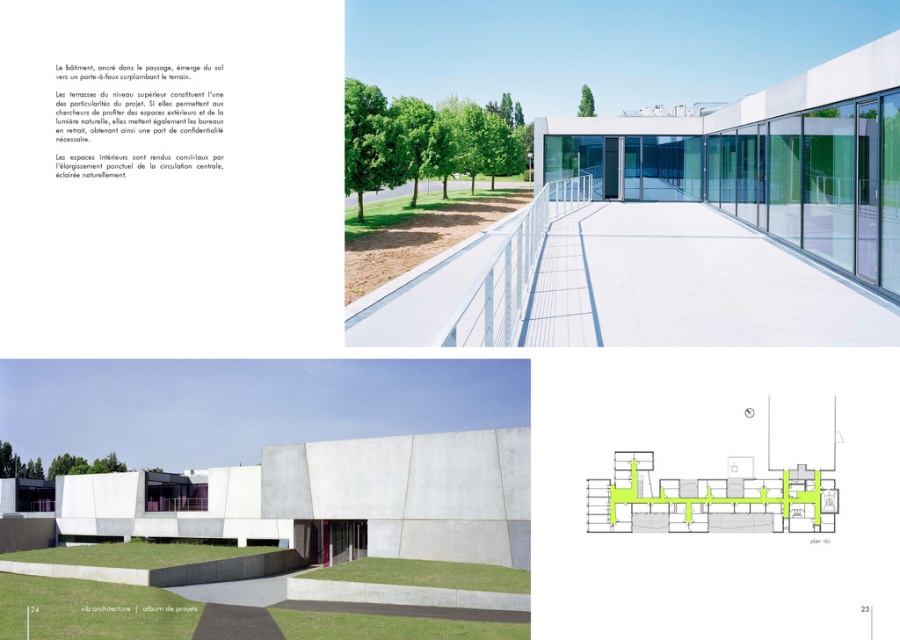
Can you confirm if white concrete building at center is positioned to the right of green concrete staircase at center?

Incorrect, white concrete building at center is not on the right side of green concrete staircase at center.

The image size is (900, 640). Describe the element at coordinates (338, 497) in the screenshot. I see `white concrete building at center` at that location.

Identify the location of white concrete building at center. The image size is (900, 640). (338, 497).

Based on the photo, who is higher up, white glass building at center or green concrete staircase at center?

white glass building at center is higher up.

Who is more distant from viewer, (361, 326) or (788, 525)?

Positioned behind is point (361, 326).

Identify the location of white glass building at center. This screenshot has width=900, height=640. (729, 218).

Can you confirm if white glass building at center is smaller than white concrete building at center?

Yes.

Which is in front, point (783, 102) or point (339, 496)?

Point (783, 102) is in front.

At what (x,y) coordinates should I click in order to perform the action: click on white glass building at center. Please return your answer as a coordinate pair (x, y). The height and width of the screenshot is (640, 900). Looking at the image, I should click on (729, 218).